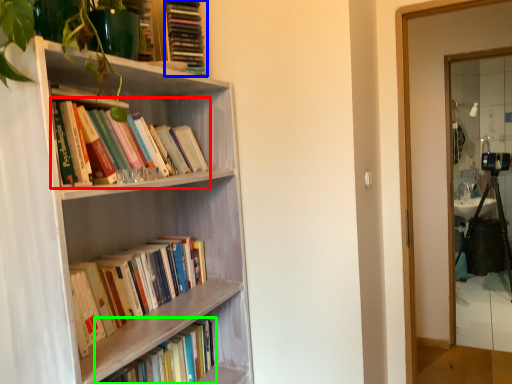
Question: Based on their relative distances, which object is farther from book (highlighted by a red box)? Choose from book (highlighted by a blue box) and book (highlighted by a green box).

Choices:
 (A) book
 (B) book

Answer: (B)